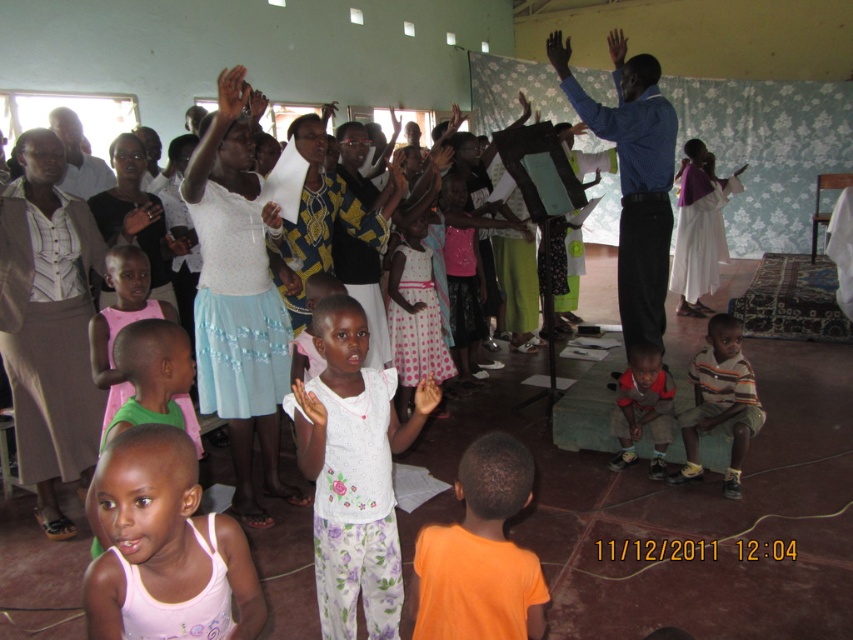
You are a photographer in the room and want to take a picture of the blue shirt at center and the smooth skin hand at center. Which object should you focus on first if you want to capture both clearly in the same frame?

The blue shirt at center is positioned over smooth skin hand at center, so you should focus on the blue shirt at center first to ensure both are in focus.

Where is the striped cotton shirt at lower right located in the image?

The striped cotton shirt at lower right is located at point (720, 401).